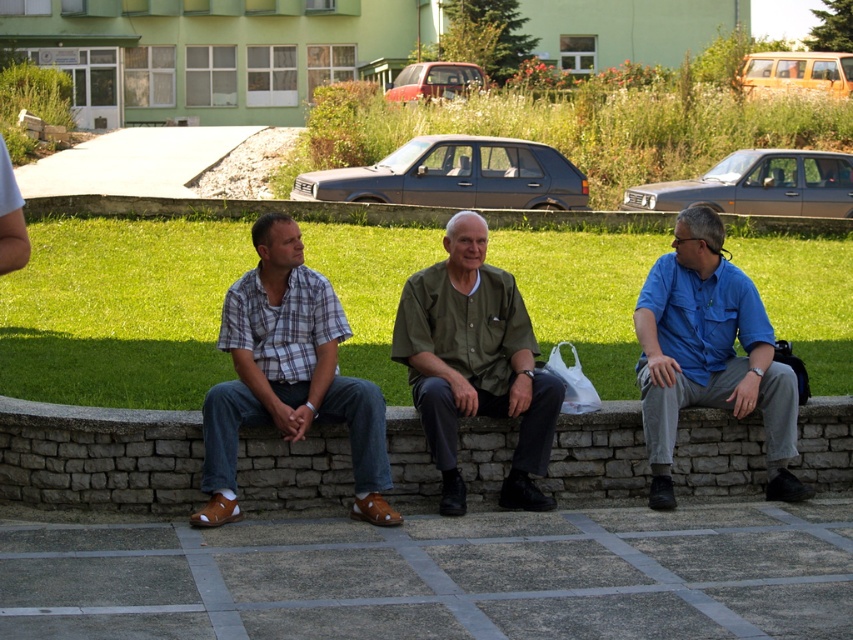
You are standing in front of the stone wall where the three men are sitting. You notice two points marked on the wall at coordinates point [338,321] and point [463,262]. Which point is closer to you?

Point [338,321] is closer to the viewer than point [463,262].

You are standing at the origin point of the coordinate system. You want to walk to the stone bench at center. In which direction should you walk?

The stone bench at center is located at coordinate point (99, 456), so you should walk towards the northeast direction to reach it.